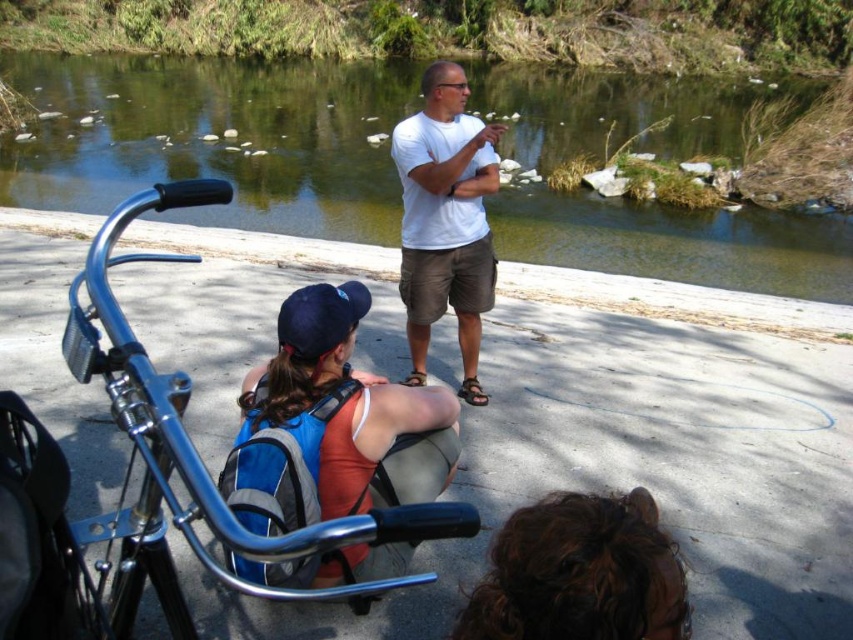
Who is positioned more to the left, green water at upper center or shiny metallic bicycle at lower left?

From the viewer's perspective, green water at upper center appears more on the left side.

Which is below, green water at upper center or shiny metallic bicycle at lower left?

shiny metallic bicycle at lower left

I want to click on green water at upper center, so click(213, 138).

Does shiny metallic bicycle at lower left have a lesser width compared to white cotton shirt at center?

No.

Which is below, shiny metallic bicycle at lower left or white cotton shirt at center?

Positioned lower is shiny metallic bicycle at lower left.

Between point (198, 544) and point (410, 323), which one is positioned in front?

Point (198, 544) is in front.

Locate an element on the screen. This screenshot has height=640, width=853. shiny metallic bicycle at lower left is located at coordinates (235, 460).

Can you confirm if dark brown curly hair at lower center is smaller than white cotton shirt at center?

Indeed, dark brown curly hair at lower center has a smaller size compared to white cotton shirt at center.

Who is more distant from viewer, [677,630] or [461,276]?

Positioned behind is point [461,276].

Which is in front, point (523, 538) or point (469, 216)?

Point (523, 538) is more forward.

Locate an element on the screen. dark brown curly hair at lower center is located at coordinates (579, 573).